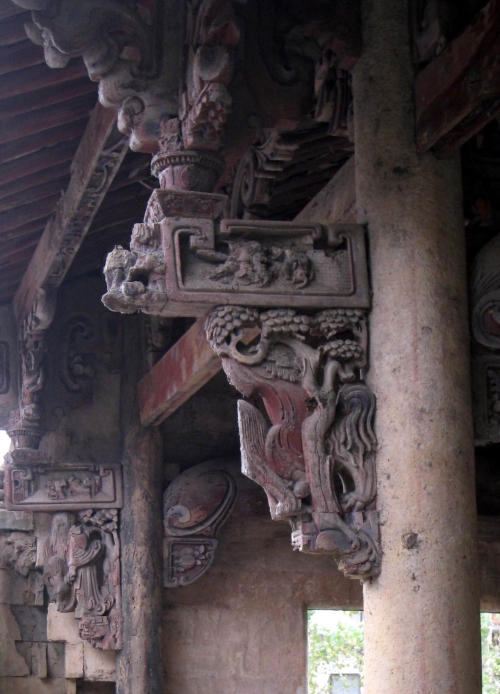
Where is `walll`? walll is located at coordinates (271, 650).